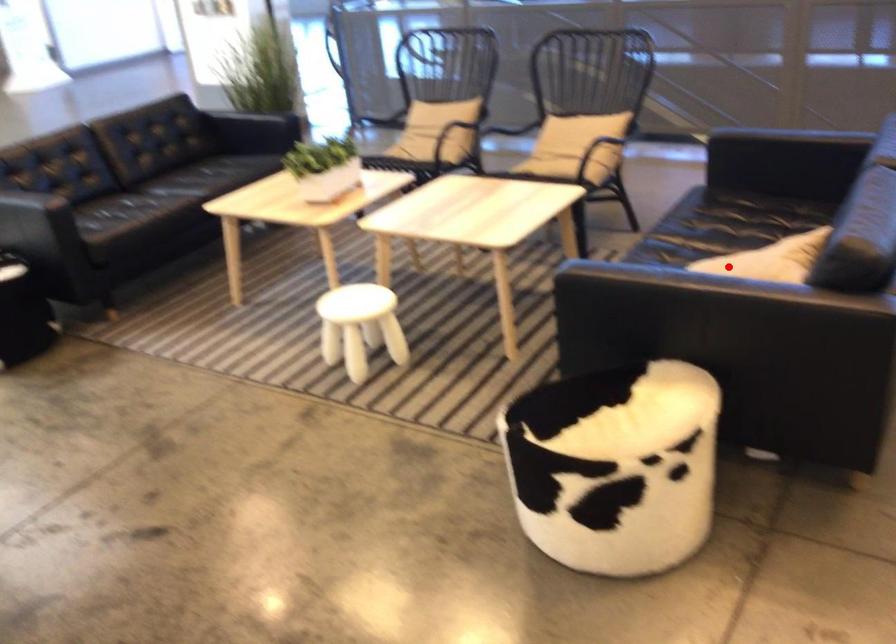
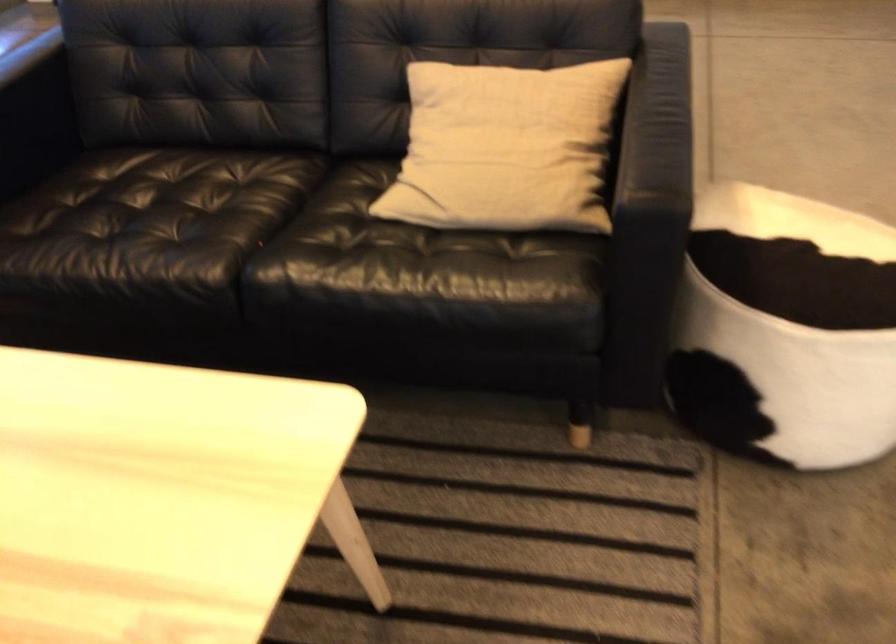
Question: I am providing you with two images of the same scene from different viewpoints. In image1, a red point is highlighted. Considering the same 3D point in image2, which of the following is correct?

Choices:
 (A) It is closer
 (B) It is farther

Answer: (A)